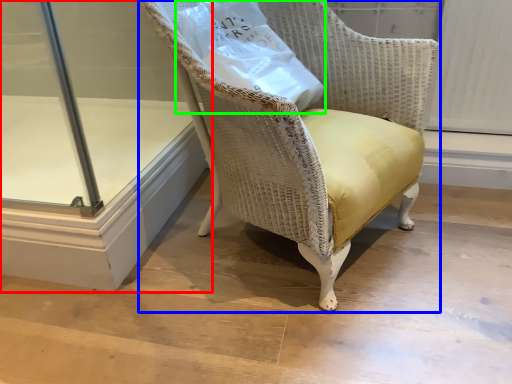
Question: Estimate the real-world distances between objects in this image. Which object is farther from glass door (highlighted by a red box), chair (highlighted by a blue box) or paper bag (highlighted by a green box)?

Choices:
 (A) chair
 (B) paper bag

Answer: (B)